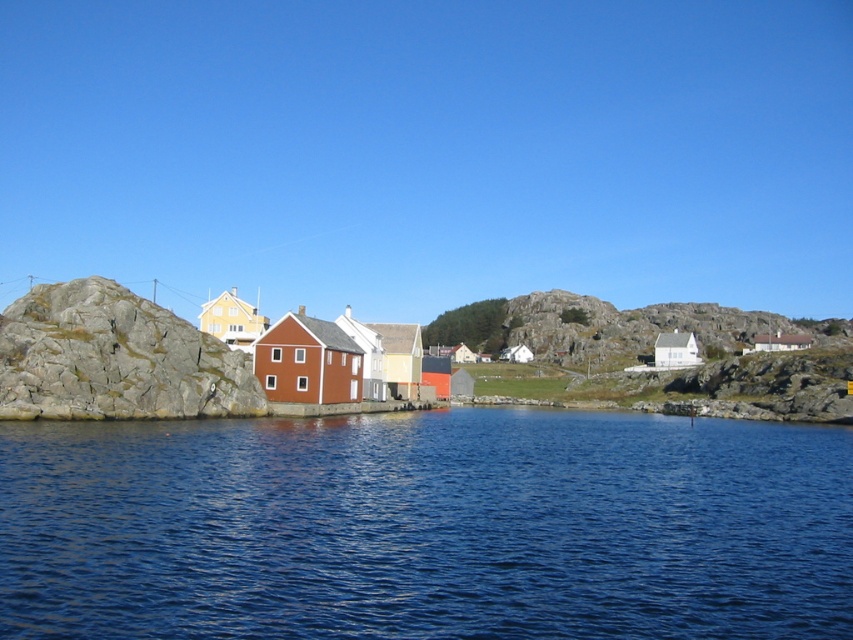
Can you confirm if blue liquid water at center is thinner than rough textured rock at left?

No, blue liquid water at center is not thinner than rough textured rock at left.

Can you confirm if blue liquid water at center is wider than rough textured rock at left?

Correct, the width of blue liquid water at center exceeds that of rough textured rock at left.

Who is more forward, (386,518) or (18,353)?

Point (386,518)

Find the location of a particular element. The height and width of the screenshot is (640, 853). blue liquid water at center is located at coordinates (426, 528).